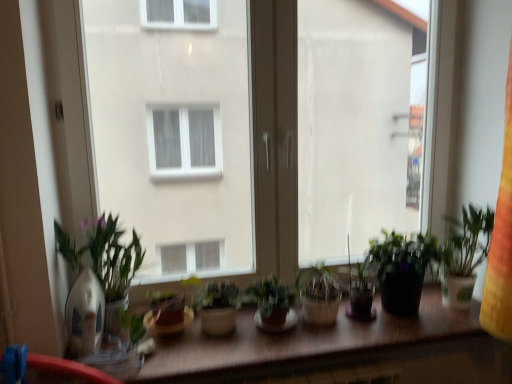
Where is `space that is in front of green matte plant at center, which is the 2th houseplant from right to left`? space that is in front of green matte plant at center, which is the 2th houseplant from right to left is located at coordinates (279, 353).